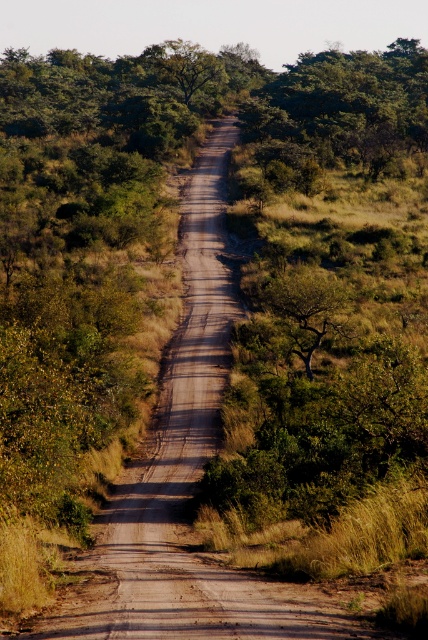
You are a hiker planning to walk along the dirt road shown in the image. You notice two green leafy trees along the path. The first is the green leafy tree at upper center, and the second is the green leafy tree at center. How far apart are these two trees?

The distance between the green leafy tree at upper center and the green leafy tree at center is 57.68 meters.

You are a hiker standing at the start of the dirt road and see the green leafy tree at upper center and the green leafy tree at center. Which tree appears wider from your perspective?

The green leafy tree at upper center might be wider than the green leafy tree at center, so it appears wider from your perspective.